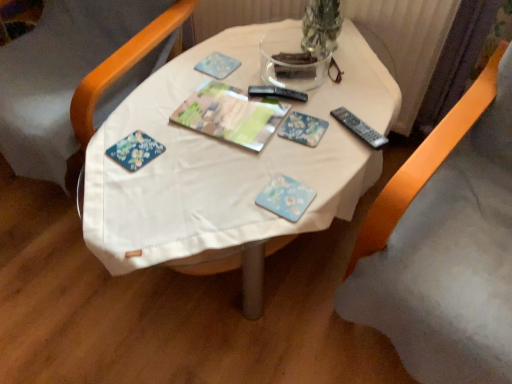
In order to click on free space in front of floral-patterned paper at center-left in this screenshot , I will do `click(137, 197)`.